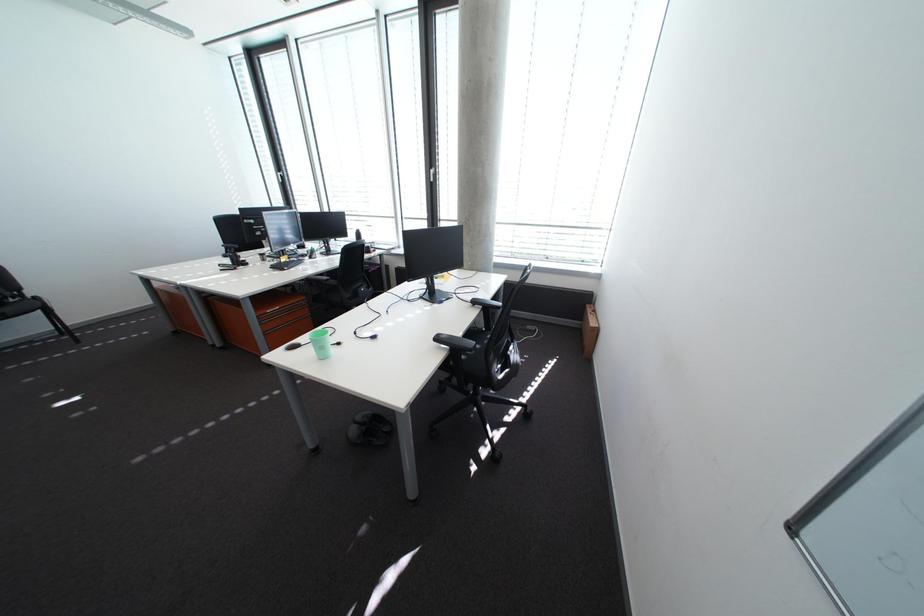
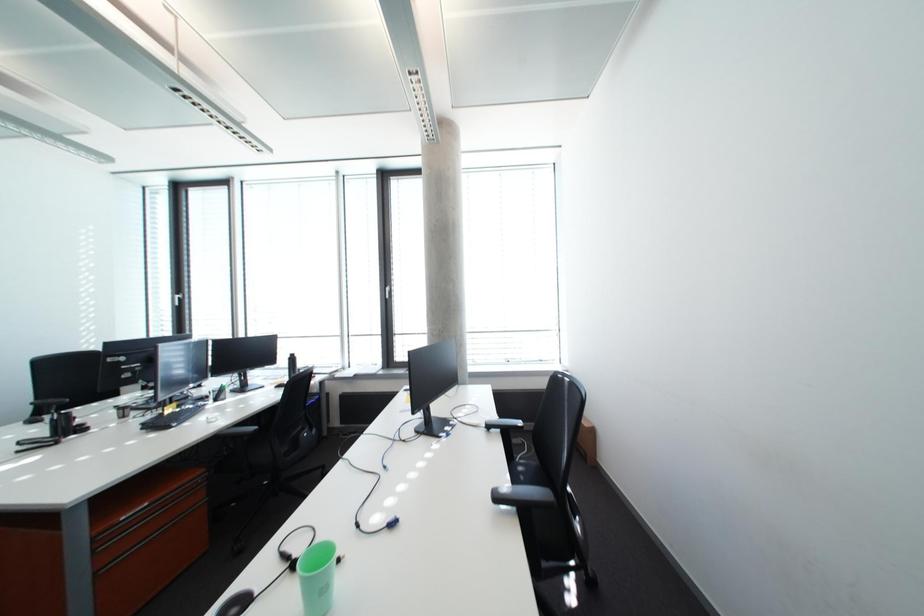
The first image is from the beginning of the video and the second image is from the end. How did the camera likely rotate when shooting the video?

The camera rotated toward right-up.